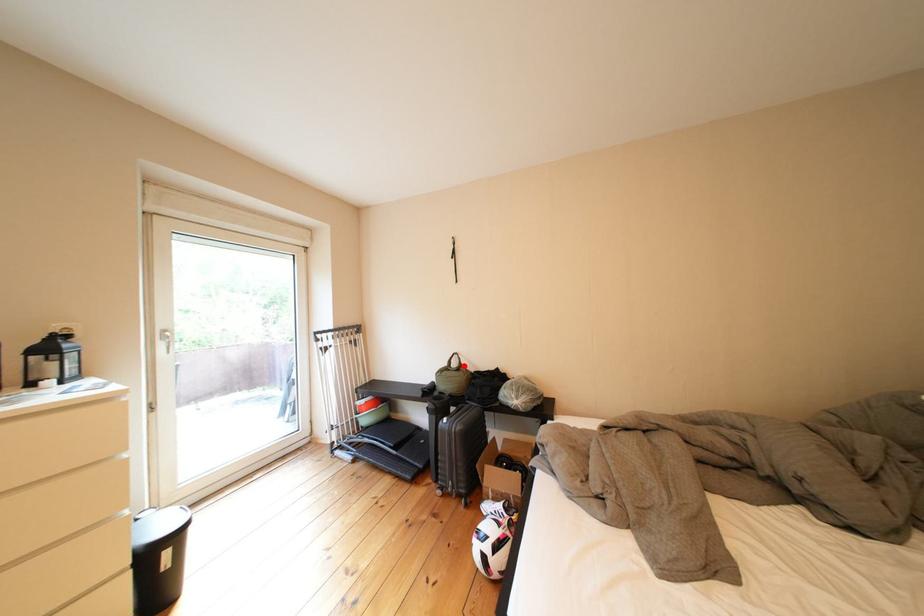
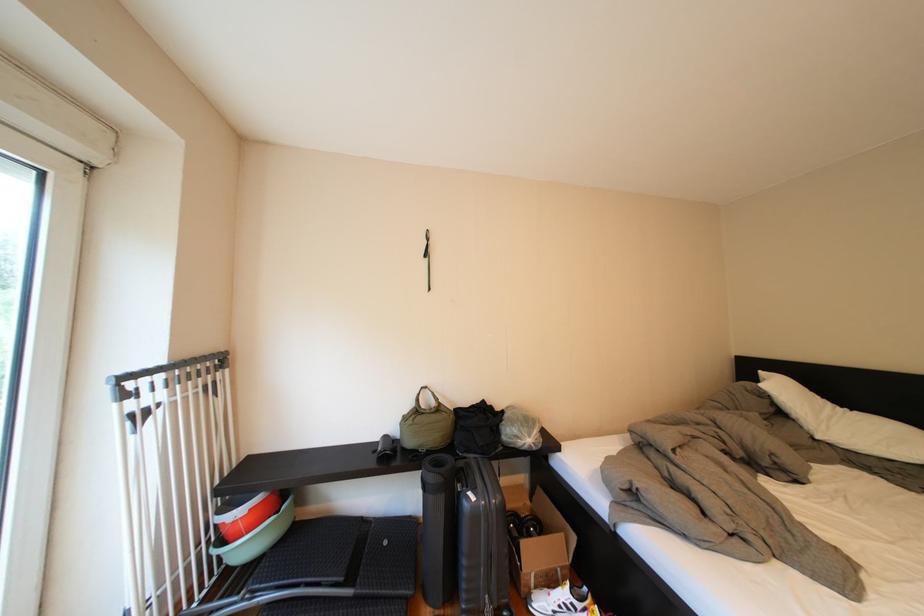
In the second image, find the point that corresponds to the highlighted location in the first image.

(431, 405)